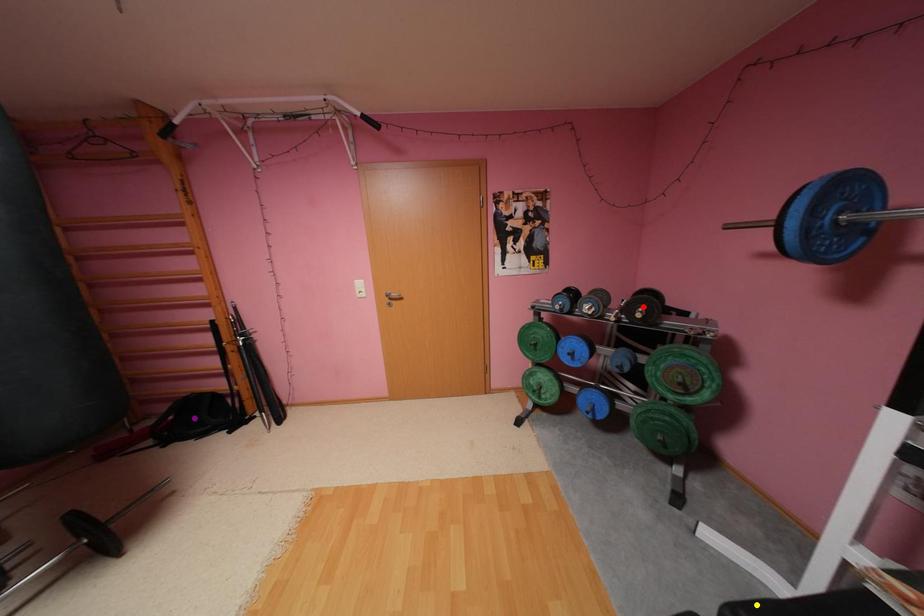
Order these from nearest to farthest:
1. yellow point
2. red point
3. purple point

yellow point → red point → purple point